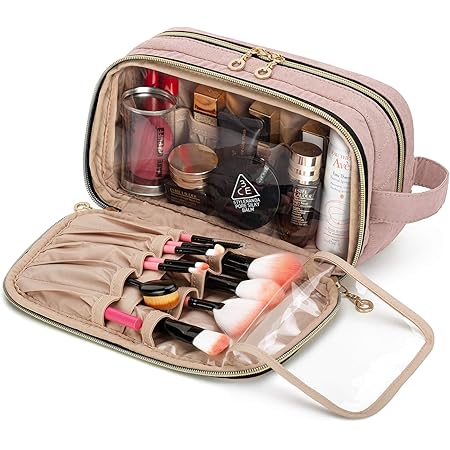
The image size is (450, 450). I want to click on makeup containers, so click(337, 200), click(315, 169), click(315, 135), click(269, 108), click(254, 191), click(247, 134), click(200, 158), click(205, 102), click(158, 292).